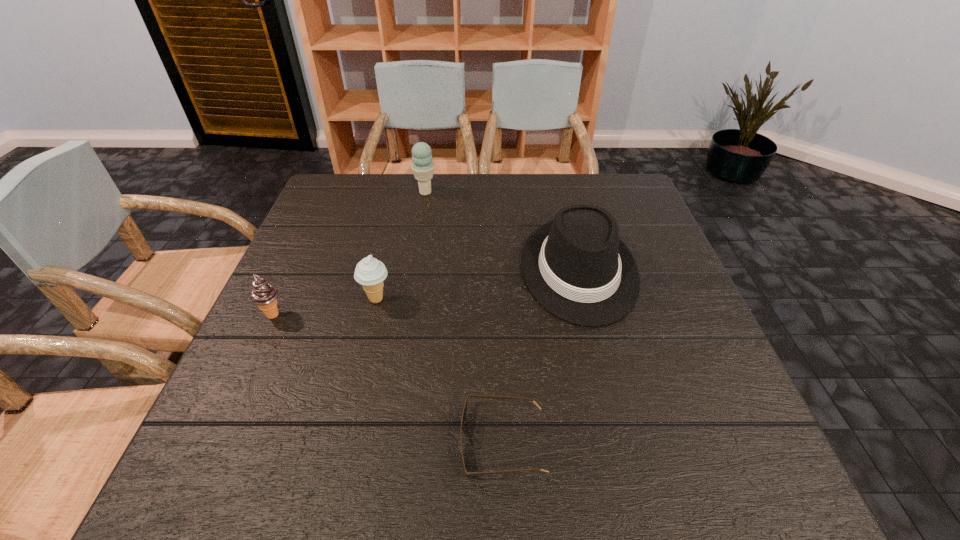
Image resolution: width=960 pixels, height=540 pixels. In the image, there is a desktop. Identify the location of blank space at the left edge. (261, 399).

I want to click on blank area at the right edge, so click(x=688, y=364).

This screenshot has height=540, width=960. I want to click on vacant space at the near left corner of the desktop, so click(232, 467).

At what (x,y) coordinates should I click in order to perform the action: click on free location at the far right corner of the desktop. Please return your answer as a coordinate pair (x, y). This screenshot has height=540, width=960. Looking at the image, I should click on (617, 189).

Identify the location of vacant point located between the fedora and the fourth object from right to left. (478, 285).

Where is `free space between the leftmost icecream and the fedora`? Image resolution: width=960 pixels, height=540 pixels. free space between the leftmost icecream and the fedora is located at coordinates (426, 292).

This screenshot has width=960, height=540. Identify the location of vacant region between the fedora and the third object from left to right. (502, 231).

In order to click on empty location between the sunglasses and the fedora in this screenshot , I will do `click(540, 356)`.

I want to click on unoccupied area between the fedora and the fourth object from right to left, so click(x=478, y=285).

Where is `free space that is in between the leftmost object and the fourth object from right to left`? This screenshot has width=960, height=540. free space that is in between the leftmost object and the fourth object from right to left is located at coordinates (324, 307).